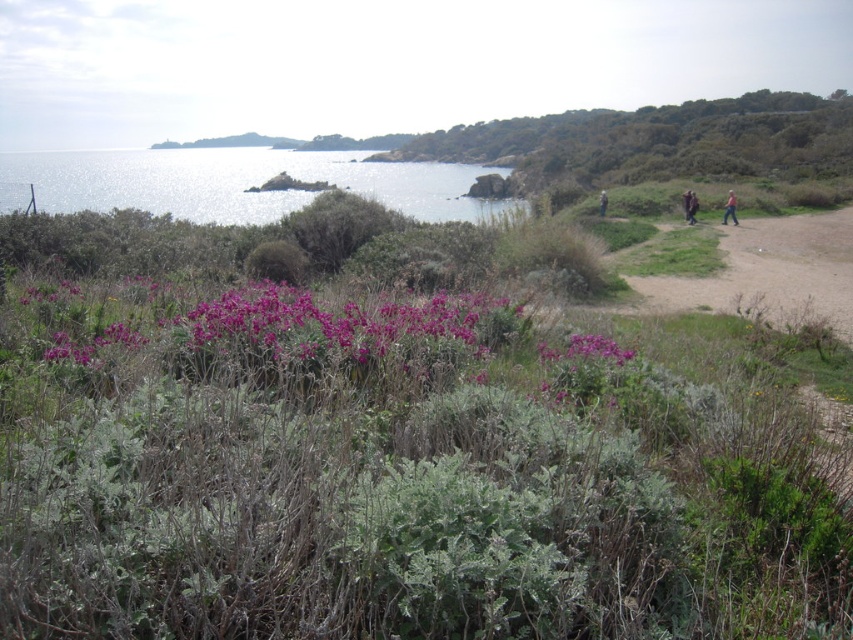
Who is more forward, [688,195] or [601,195]?

Point [688,195] is in front.

Between brown woolen sweater at right and brown leather jacket at upper right, which one appears on the left side from the viewer's perspective?

Positioned to the left is brown leather jacket at upper right.

Does point (692, 205) lie in front of point (602, 204)?

Yes, point (692, 205) is closer to viewer.

Where is `brown woolen sweater at right`? The height and width of the screenshot is (640, 853). brown woolen sweater at right is located at coordinates (689, 205).

Does pink fabric at right appear under brown leather jacket at upper right?

Yes.

Does pink fabric at right appear on the left side of brown leather jacket at upper right?

No, pink fabric at right is not to the left of brown leather jacket at upper right.

Between point (733, 221) and point (601, 212), which one is positioned in front?

Positioned in front is point (733, 221).

I want to click on pink fabric at right, so pos(729,209).

Which is in front, point (349, 163) or point (693, 214)?

Positioned in front is point (693, 214).

Is shiny metallic water at upper left positioned before brown woolen sweater at right?

Yes, it is.

Measure the distance between shiny metallic water at upper left and camera.

102.24 feet

Identify the location of shiny metallic water at upper left. Image resolution: width=853 pixels, height=640 pixels. (236, 182).